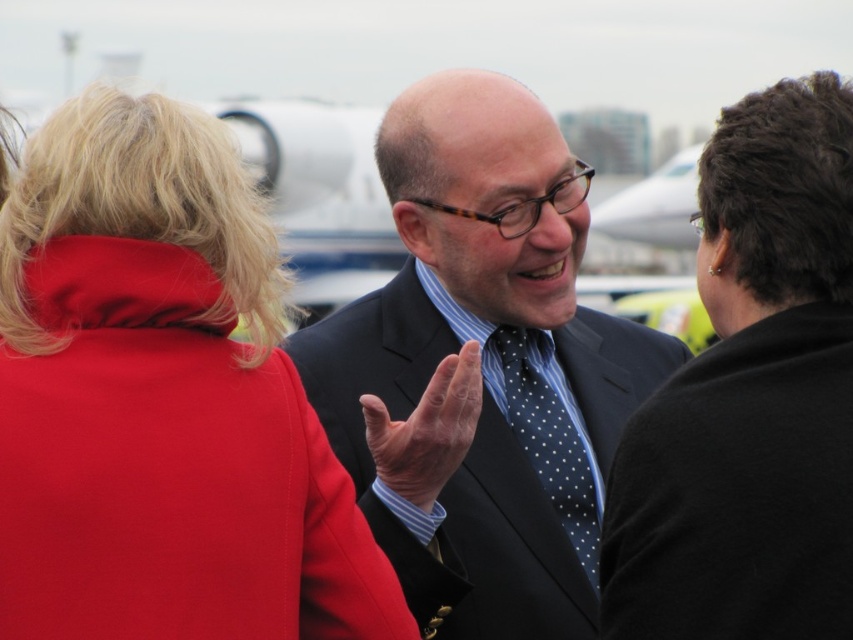
You are an airport security officer checking the width of items. You see the black woolen jacket at upper right and the blue dotted fabric tie at center. Which item is wider?

The black woolen jacket at upper right is wider than the blue dotted fabric tie at center because its width surpasses the tie.